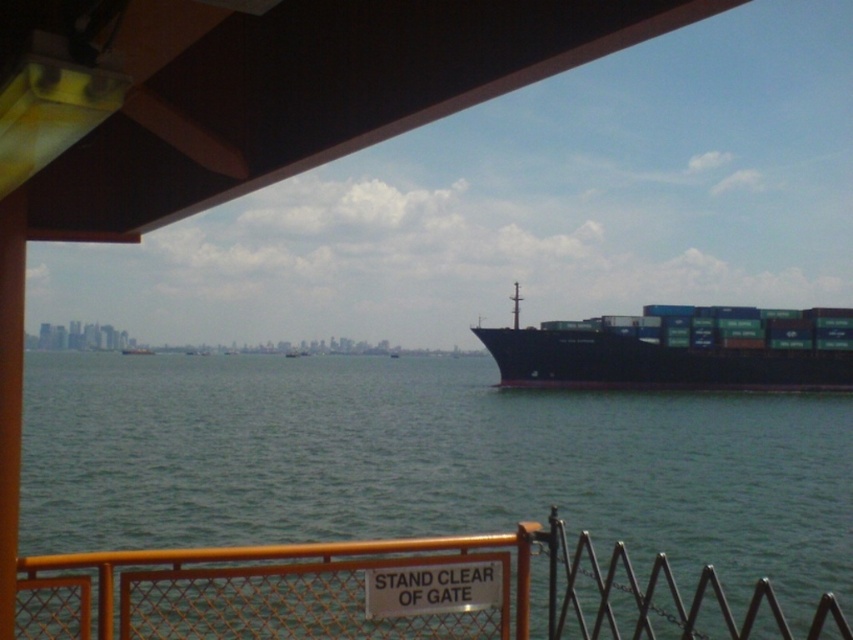
You are a dock worker who needs to secure a new container onto the black matte container ship at right. To do this, you must first ensure there is enough space between the yellow metal fence at lower center and the ship. Is there sufficient space for you to safely maneuver your crane and place the container?

The yellow metal fence at lower center is positioned under the black matte container ship at right, meaning there is no vertical space between them. This would make it unsafe to maneuver the crane and place the container.

You are standing at the point marked as point (426, 460). Looking around, you see green water at lower center. What is directly beneath your feet?

The point (426, 460) is where the green water at lower center is located, so the green water at lower center is directly beneath your feet.